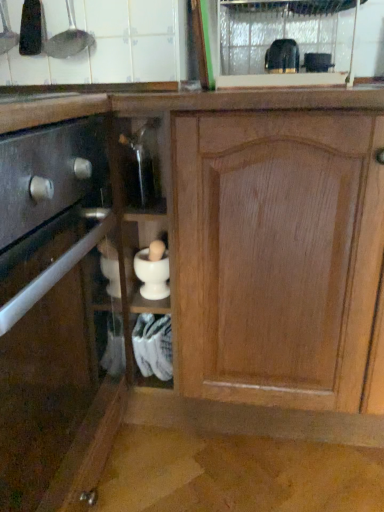
Question: Is matte black drawer at left, acting as the 2th cabinetry starting from the right, wider than black plastic toaster at upper center, the 5th appliance when ordered from left to right?

Choices:
 (A) yes
 (B) no

Answer: (A)

Question: Is black plastic toaster at upper center, the 5th appliance when ordered from left to right, a part of matte black drawer at left, acting as the 2th cabinetry starting from the right?

Choices:
 (A) yes
 (B) no

Answer: (B)

Question: Considering the relative sizes of matte black drawer at left, the 1th cabinetry when ordered from left to right, and black plastic toaster at upper center, the 5th appliance when ordered from left to right, in the image provided, is matte black drawer at left, the 1th cabinetry when ordered from left to right, bigger than black plastic toaster at upper center, the 5th appliance when ordered from left to right,?

Choices:
 (A) no
 (B) yes

Answer: (B)

Question: Is matte black drawer at left, acting as the 2th cabinetry starting from the right, behind black plastic toaster at upper center, the 5th appliance when ordered from left to right?

Choices:
 (A) yes
 (B) no

Answer: (B)

Question: Does matte black drawer at left, the 1th cabinetry when ordered from left to right, appear on the right side of black plastic toaster at upper center, positioned as the 2th appliance in right-to-left order?

Choices:
 (A) yes
 (B) no

Answer: (B)

Question: Relative to metallic silver ladle at upper left, the 1th appliance in the left-to-right sequence, is black plastic toaster at upper center, which appears as the first appliance when viewed from the right, in front or behind?

Choices:
 (A) front
 (B) behind

Answer: (B)

Question: Looking at the image, does black plastic toaster at upper center, which appears as the first appliance when viewed from the right, seem bigger or smaller compared to metallic silver ladle at upper left, placed as the 6th appliance when sorted from right to left?

Choices:
 (A) big
 (B) small

Answer: (B)

Question: From a real-world perspective, relative to metallic silver ladle at upper left, placed as the 6th appliance when sorted from right to left, is black plastic toaster at upper center, which is counted as the 6th appliance, starting from the left, vertically above or below?

Choices:
 (A) below
 (B) above

Answer: (A)

Question: Is point click(x=317, y=57) positioned closer to the camera than point click(x=3, y=19)?

Choices:
 (A) farther
 (B) closer

Answer: (A)

Question: In the image, is transparent plastic glass door at upper center on the left side or the right side of white matte mortar and pestle at center, which appears as the 3th appliance when viewed from the right?

Choices:
 (A) right
 (B) left

Answer: (A)

Question: Does point (291, 61) appear closer or farther from the camera than point (163, 268)?

Choices:
 (A) closer
 (B) farther

Answer: (B)

Question: Which is correct: transparent plastic glass door at upper center is inside white matte mortar and pestle at center, positioned as the 4th appliance in left-to-right order, or outside of it?

Choices:
 (A) inside
 (B) outside

Answer: (B)

Question: Is transparent plastic glass door at upper center bigger or smaller than white matte mortar and pestle at center, positioned as the 4th appliance in left-to-right order?

Choices:
 (A) small
 (B) big

Answer: (B)

Question: Considering the positions of black plastic toaster at upper center, the 5th appliance when ordered from left to right, and matte black drawer at left, the 1th cabinetry when ordered from left to right, in the image, is black plastic toaster at upper center, the 5th appliance when ordered from left to right, bigger or smaller than matte black drawer at left, the 1th cabinetry when ordered from left to right,?

Choices:
 (A) small
 (B) big

Answer: (A)

Question: Would you say black plastic toaster at upper center, positioned as the 2th appliance in right-to-left order, is to the left or to the right of matte black drawer at left, acting as the 2th cabinetry starting from the right, in the picture?

Choices:
 (A) right
 (B) left

Answer: (A)